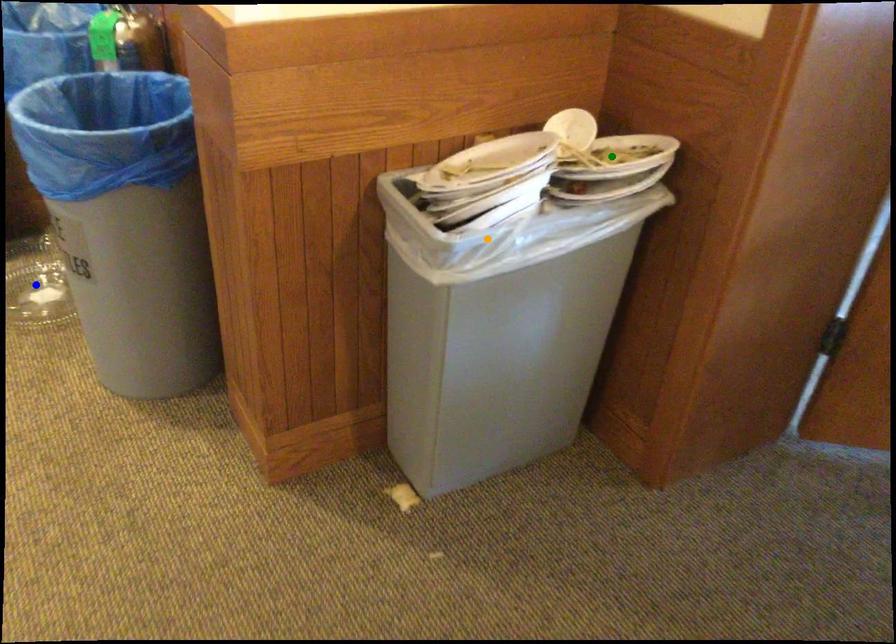
Order these from nearest to farthest:
blue point | green point | orange point

1. orange point
2. green point
3. blue point